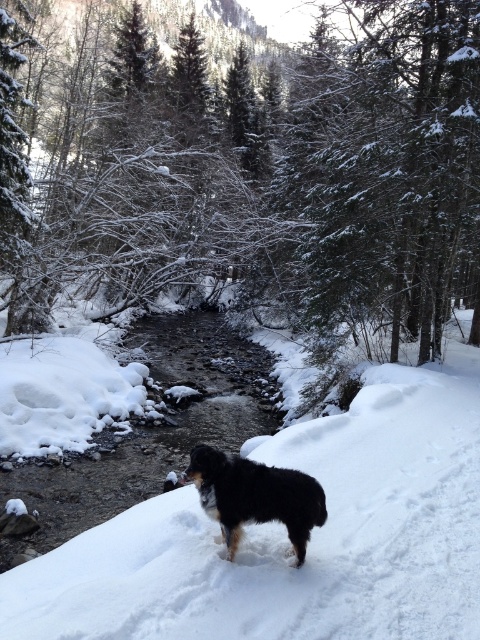
You are standing at the point marked by the coordinates (287, 540) in the winter forest scene. Based on the image description, what is the terrain like at your current location?

The terrain at the point marked by the coordinates (287, 540) is white fluffy snow at center, as described in the scene.